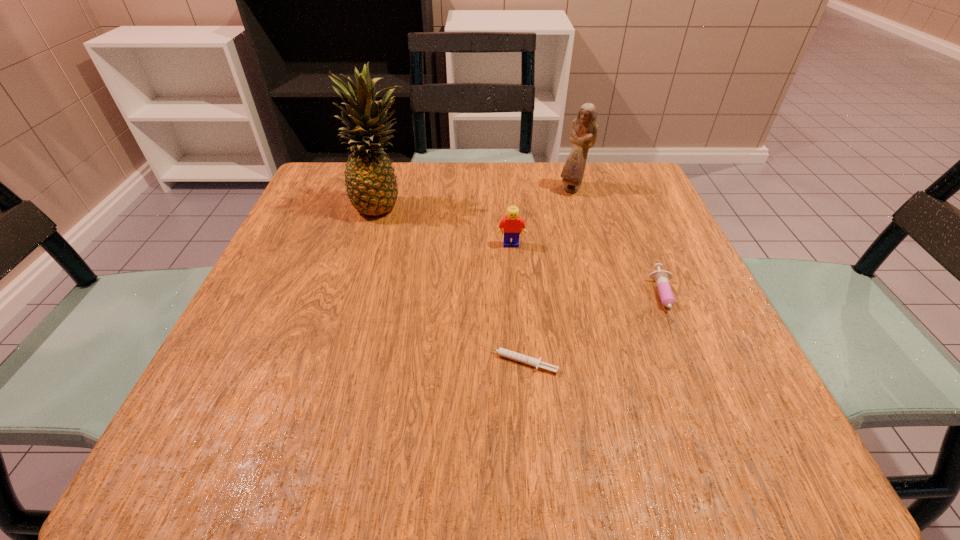
This screenshot has width=960, height=540. I want to click on vacant space located 0.080m on the left of the leftmost object, so click(317, 205).

Identify the location of free space located 0.210m on the front-facing side of the fourth object from left to right. This screenshot has height=540, width=960. (591, 255).

Where is `free spot located 0.060m on the front-facing side of the Lego`? Image resolution: width=960 pixels, height=540 pixels. free spot located 0.060m on the front-facing side of the Lego is located at coordinates (513, 268).

Where is `free space located 0.050m on the front of the second shortest object`? free space located 0.050m on the front of the second shortest object is located at coordinates (694, 363).

You are a GUI agent. You are given a task and a screenshot of the screen. Output one action in this format:
    pyautogui.click(x=<x>, y=<y>)
    Task: Click on the vacant space positioned on the back of the shorter syringe
    The height and width of the screenshot is (540, 960).
    Given the screenshot: What is the action you would take?
    pyautogui.click(x=515, y=319)

You are a GUI agent. You are given a task and a screenshot of the screen. Output one action in this format:
    pyautogui.click(x=<x>, y=<y>)
    Task: Click on the pineapple located in the far edge section of the desktop
    Image resolution: width=960 pixels, height=540 pixels.
    Given the screenshot: What is the action you would take?
    pyautogui.click(x=371, y=186)

Find the location of `figurine that is positioned at the far edge`. figurine that is positioned at the far edge is located at coordinates (583, 134).

This screenshot has width=960, height=540. In order to click on object located in the left edge section of the desktop in this screenshot , I will do `click(371, 186)`.

Image resolution: width=960 pixels, height=540 pixels. What are the coordinates of `figurine that is at the right edge` in the screenshot? It's located at (583, 134).

Image resolution: width=960 pixels, height=540 pixels. I want to click on syringe located in the right edge section of the desktop, so click(661, 277).